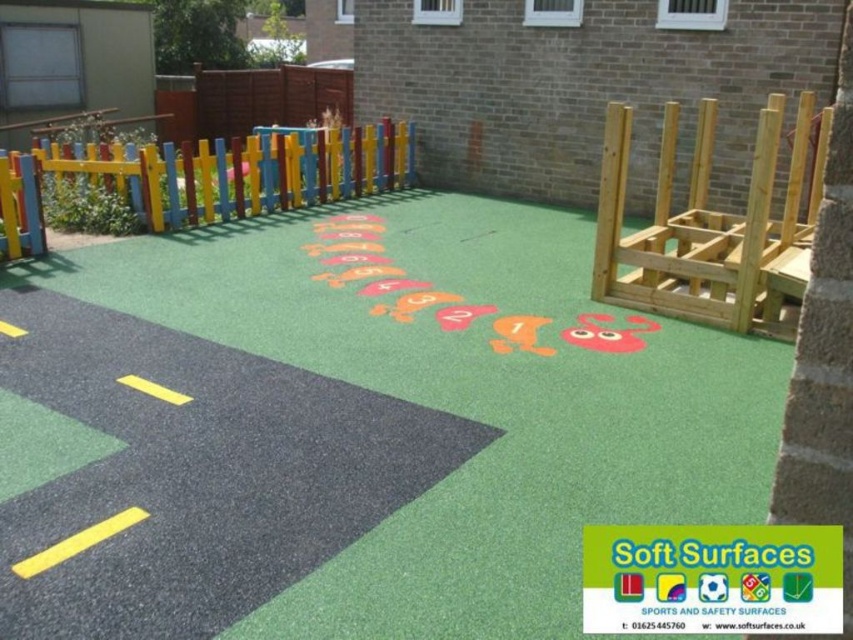
Question: Estimate the real-world distances between objects in this image. Which object is farther from the multicolored wooden fence at upper left?

Choices:
 (A) green rubberized playground surface at center
 (B) black asphalt road at lower left

Answer: (A)

Question: Observing the image, what is the correct spatial positioning of green rubberized playground surface at center in reference to multicolored wooden fence at upper left?

Choices:
 (A) left
 (B) right

Answer: (B)

Question: Which of the following is the closest to the observer?

Choices:
 (A) multicolored wooden fence at upper left
 (B) green rubberized playground surface at center

Answer: (B)

Question: Can you confirm if black asphalt road at lower left is smaller than multicolored wooden fence at upper left?

Choices:
 (A) yes
 (B) no

Answer: (A)

Question: Which of the following is the closest to the observer?

Choices:
 (A) coord(370,188)
 (B) coord(27,456)
 (C) coord(306,474)

Answer: (C)

Question: Does green rubberized playground surface at center lie in front of black asphalt road at lower left?

Choices:
 (A) yes
 (B) no

Answer: (B)